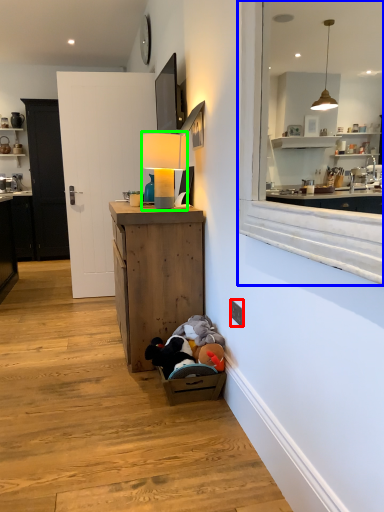
Question: Which is nearer to the electric outlet (highlighted by a red box)? window (highlighted by a blue box) or table lamp (highlighted by a green box).

Choices:
 (A) window
 (B) table lamp

Answer: (A)